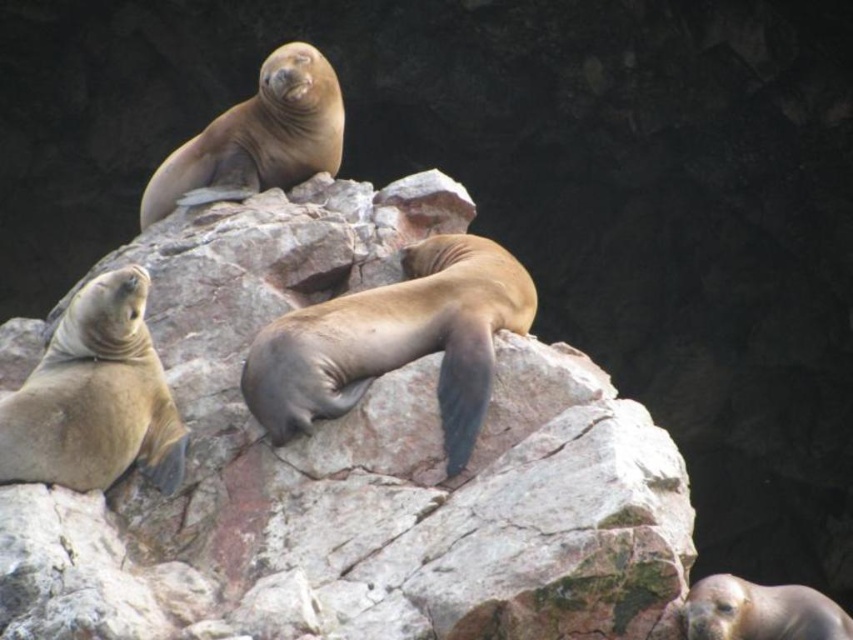
Question: Is brown rough rock at center positioned behind brown smooth seal at center?

Choices:
 (A) no
 (B) yes

Answer: (A)

Question: Among these points, which one is nearest to the camera?

Choices:
 (A) (438, 236)
 (B) (437, 529)

Answer: (B)

Question: Among these objects, which one is nearest to the camera?

Choices:
 (A) brown smooth seal at center
 (B) brown rough rock at center

Answer: (B)

Question: Does brown rough rock at center have a larger size compared to brown smooth seal at center?

Choices:
 (A) yes
 (B) no

Answer: (A)

Question: Considering the relative positions of brown rough rock at center and brown smooth seal at center in the image provided, where is brown rough rock at center located with respect to brown smooth seal at center?

Choices:
 (A) above
 (B) below

Answer: (B)